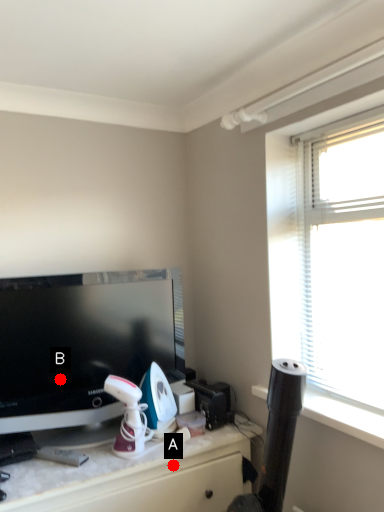
Question: Two points are circled on the image, labeled by A and B beside each circle. Which point appears farthest from the camera in this image?

Choices:
 (A) A is further
 (B) B is further

Answer: (B)